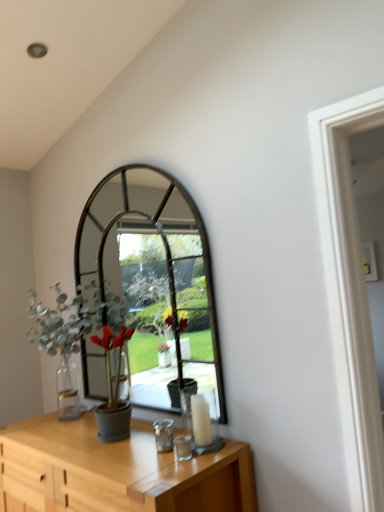
At what (x,y) coordinates should I click in order to perform the action: click on green matte plant at left. Please return your answer as a coordinate pair (x, y). This screenshot has height=512, width=384. Looking at the image, I should click on (74, 325).

In order to click on white glass candle at center in this screenshot , I will do `click(198, 422)`.

Is green matte plant at left at the back of white glass candle at center?

No.

Which of these two, white glass candle at center or green matte plant at left, is wider?

green matte plant at left.

Relative to green matte plant at left, is light wood table at lower center in front or behind?

Visually, light wood table at lower center is located in front of green matte plant at left.

From the image's perspective, between light wood table at lower center and green matte plant at left, who is located below?

light wood table at lower center, from the image's perspective.

Is point (93, 460) positioned after point (60, 317)?

No, it is not.

Based on the photo, can you confirm if green matte plant at left is thinner than white glass candle at center?

No.

Is green matte plant at left further to camera compared to white glass candle at center?

Yes, it is behind white glass candle at center.

From the image's perspective, relative to white glass candle at center, is green matte plant at left above or below?

From the image's perspective, green matte plant at left appears above white glass candle at center.

In terms of height, does green matte plant at left look taller or shorter compared to white glass candle at center?

Clearly, green matte plant at left is taller compared to white glass candle at center.

In the scene shown: From the image's perspective, who appears lower, green matte plant at left or light wood table at lower center?

light wood table at lower center is shown below in the image.

Considering the sizes of objects green matte plant at left and light wood table at lower center in the image provided, who is thinner, green matte plant at left or light wood table at lower center?

green matte plant at left.

Is green matte plant at left turned away from light wood table at lower center?

green matte plant at left does not have its back to light wood table at lower center.

In terms of height, does green matte plant at left look taller or shorter compared to light wood table at lower center?

Clearly, green matte plant at left is taller compared to light wood table at lower center.

In terms of width, does white glass candle at center look wider or thinner when compared to light wood table at lower center?

Clearly, white glass candle at center has less width compared to light wood table at lower center.

Is white glass candle at center oriented away from light wood table at lower center?

white glass candle at center is not turned away from light wood table at lower center.

Is white glass candle at center directly adjacent to light wood table at lower center?

No, white glass candle at center is not touching light wood table at lower center.

From the image's perspective, which is above, white glass candle at center or light wood table at lower center?

white glass candle at center.

From a real-world perspective, is light wood table at lower center above or below white glass candle at center?

light wood table at lower center is below white glass candle at center.

Between light wood table at lower center and white glass candle at center, which one has more height?

Standing taller between the two is light wood table at lower center.

Does light wood table at lower center come in front of white glass candle at center?

Yes, light wood table at lower center is closer to the camera.

Image resolution: width=384 pixels, height=512 pixels. I want to click on candle holder located on the right of green matte plant at left, so click(198, 422).

You are a GUI agent. You are given a task and a screenshot of the screen. Output one action in this format:
    pyautogui.click(x=<x>, y=<y>)
    Task: Click on the houseplant that is on the left side of light wood table at lower center
    
    Given the screenshot: What is the action you would take?
    pyautogui.click(x=74, y=325)

Which object lies nearer to the anchor point light wood table at lower center, white glass candle at center or green matte plant at left?

The object closer to light wood table at lower center is white glass candle at center.

Which object lies nearer to the anchor point green matte plant at left, light wood table at lower center or white glass candle at center?

light wood table at lower center.

From the picture: When comparing their distances from light wood table at lower center, does green matte plant at left or white glass candle at center seem further?

green matte plant at left is positioned further to the anchor light wood table at lower center.

Which object lies further to the anchor point white glass candle at center, light wood table at lower center or green matte plant at left?

green matte plant at left is positioned further to the anchor white glass candle at center.

Considering their positions, is green matte plant at left positioned closer to white glass candle at center than light wood table at lower center?

light wood table at lower center is closer to white glass candle at center.

Estimate the real-world distances between objects in this image. Which object is closer to green matte plant at left, white glass candle at center or light wood table at lower center?

The object closer to green matte plant at left is light wood table at lower center.

Identify the location of candle holder between light wood table at lower center and green matte plant at left from front to back. The height and width of the screenshot is (512, 384). (198, 422).